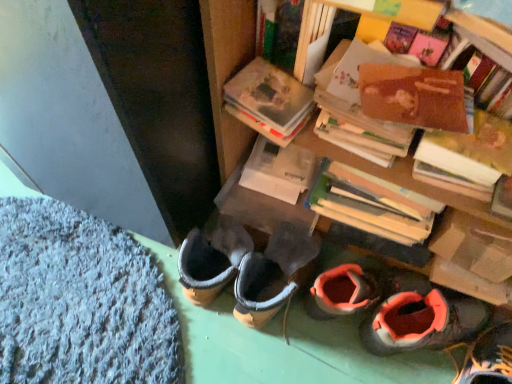
Question: Are brown cardboard book at upper right, marked as the first book in a right-to-left arrangement, and wooden bookshelf at upper right making contact?

Choices:
 (A) no
 (B) yes

Answer: (A)

Question: Does brown cardboard book at upper right, the 2th book when ordered from left to right, have a greater height compared to wooden bookshelf at upper right?

Choices:
 (A) yes
 (B) no

Answer: (B)

Question: From a real-world perspective, is brown cardboard book at upper right, marked as the first book in a right-to-left arrangement, located higher than wooden bookshelf at upper right?

Choices:
 (A) yes
 (B) no

Answer: (B)

Question: Is brown cardboard book at upper right, marked as the first book in a right-to-left arrangement, facing towards wooden bookshelf at upper right?

Choices:
 (A) no
 (B) yes

Answer: (A)

Question: Considering the relative sizes of brown cardboard book at upper right, marked as the first book in a right-to-left arrangement, and wooden bookshelf at upper right in the image provided, is brown cardboard book at upper right, marked as the first book in a right-to-left arrangement, shorter than wooden bookshelf at upper right?

Choices:
 (A) yes
 (B) no

Answer: (A)

Question: Is hardcover book at upper center, the 2th book from the right, in front of or behind white matte book at center in the image?

Choices:
 (A) front
 (B) behind

Answer: (A)

Question: Is point (286, 120) closer or farther from the camera than point (293, 193)?

Choices:
 (A) farther
 (B) closer

Answer: (B)

Question: From a real-world perspective, is hardcover book at upper center, the 2th book from the right, above or below white matte book at center?

Choices:
 (A) above
 (B) below

Answer: (A)

Question: Would you say hardcover book at upper center, the 1th book from the left, is inside or outside white matte book at center?

Choices:
 (A) inside
 (B) outside

Answer: (B)

Question: Is orange suede shoes at lower right, the 1th footwear in the left-to-right sequence, wider or thinner than hardcover book at upper center, the 1th book from the left?

Choices:
 (A) wide
 (B) thin

Answer: (A)

Question: Based on their sizes in the image, would you say orange suede shoes at lower right, the 1th footwear in the left-to-right sequence, is bigger or smaller than hardcover book at upper center, the 1th book from the left?

Choices:
 (A) big
 (B) small

Answer: (A)

Question: From a real-world perspective, is orange suede shoes at lower right, acting as the 2th footwear starting from the right, physically located above or below hardcover book at upper center, the 1th book from the left?

Choices:
 (A) below
 (B) above

Answer: (A)

Question: Considering the positions of orange suede shoes at lower right, the 1th footwear in the left-to-right sequence, and hardcover book at upper center, the 1th book from the left, in the image, is orange suede shoes at lower right, the 1th footwear in the left-to-right sequence, taller or shorter than hardcover book at upper center, the 1th book from the left,?

Choices:
 (A) tall
 (B) short

Answer: (A)

Question: In terms of height, does orange suede boot at lower right, positioned as the 1th footwear in right-to-left order, look taller or shorter compared to white matte book at center?

Choices:
 (A) tall
 (B) short

Answer: (A)

Question: Is orange suede boot at lower right, the 2th footwear positioned from the left, inside the boundaries of white matte book at center, or outside?

Choices:
 (A) outside
 (B) inside

Answer: (A)